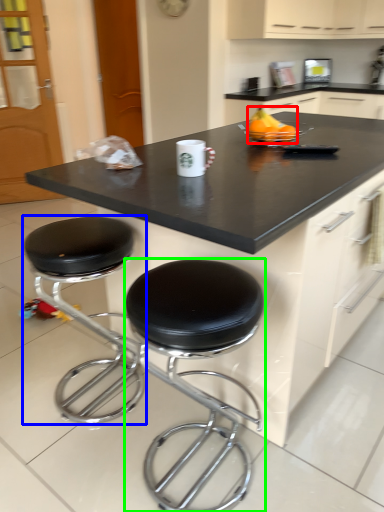
Question: Which is nearer to the fruit (highlighted by a red box)? stool (highlighted by a blue box) or stool (highlighted by a green box).

Choices:
 (A) stool
 (B) stool

Answer: (B)